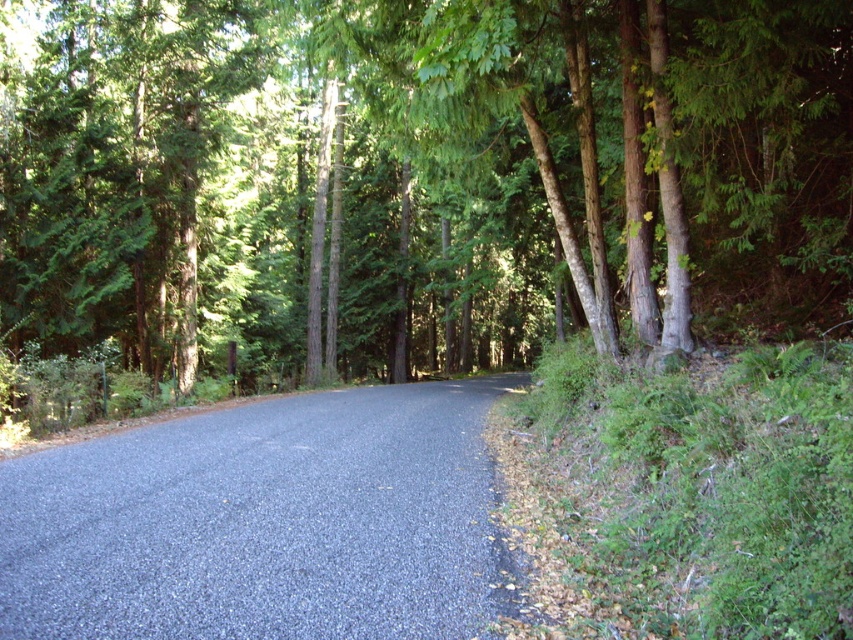
Question: Can you confirm if green leafy tree at center is wider than gray asphalt road at center?

Choices:
 (A) yes
 (B) no

Answer: (A)

Question: From the image, what is the correct spatial relationship of green leafy tree at center in relation to gray asphalt road at center?

Choices:
 (A) below
 (B) above

Answer: (B)

Question: Which point is farther from the camera taking this photo?

Choices:
 (A) (440, 58)
 (B) (392, 449)

Answer: (B)

Question: Which point is farther from the camera taking this photo?

Choices:
 (A) (444, 566)
 (B) (598, 324)

Answer: (B)

Question: Is green leafy tree at center above gray asphalt road at center?

Choices:
 (A) no
 (B) yes

Answer: (B)